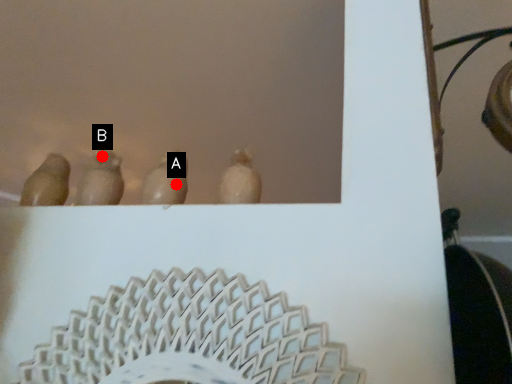
Question: Two points are circled on the image, labeled by A and B beside each circle. Among these points, which one is nearest to the camera?

Choices:
 (A) A is closer
 (B) B is closer

Answer: (A)